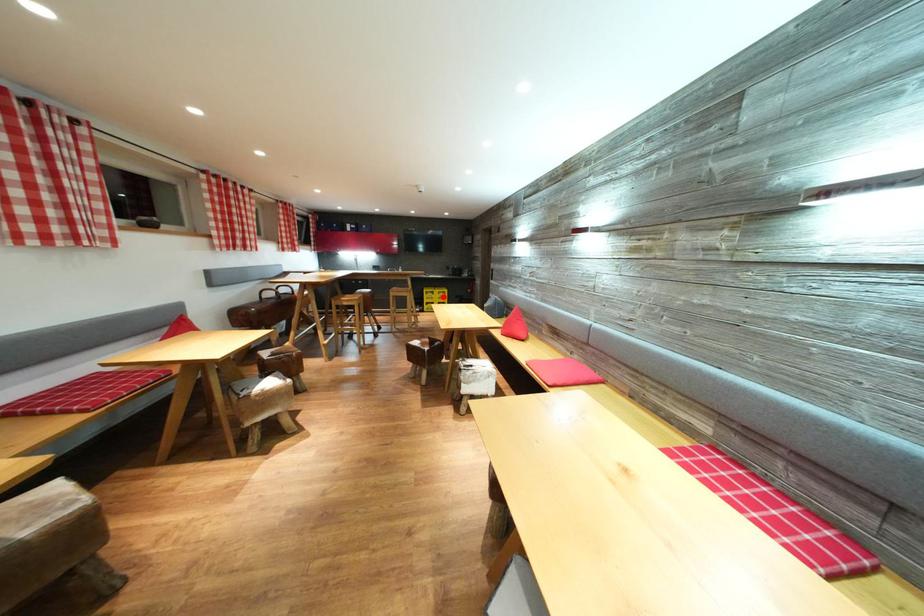
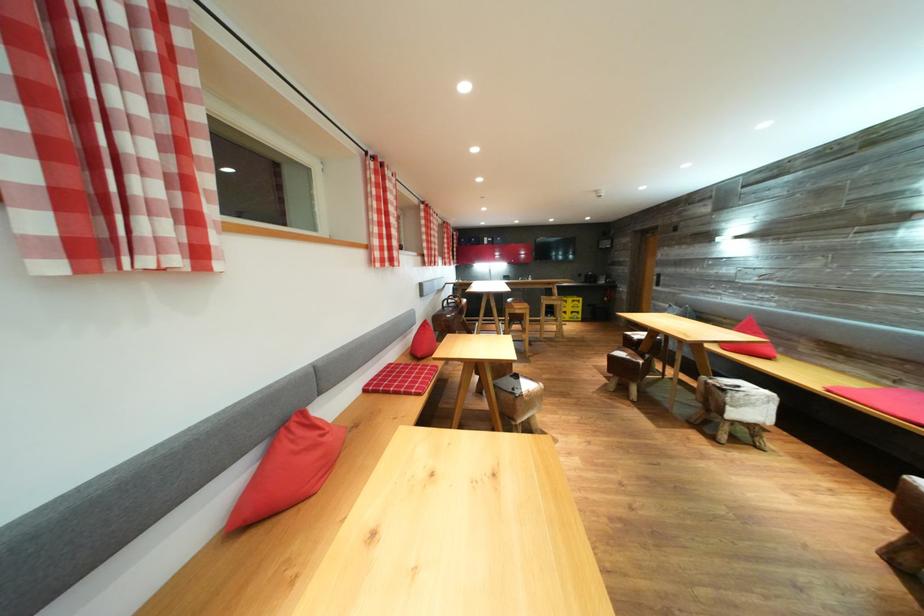
Find the pixel in the second image that matches the highlighted location in the first image.

(577, 305)